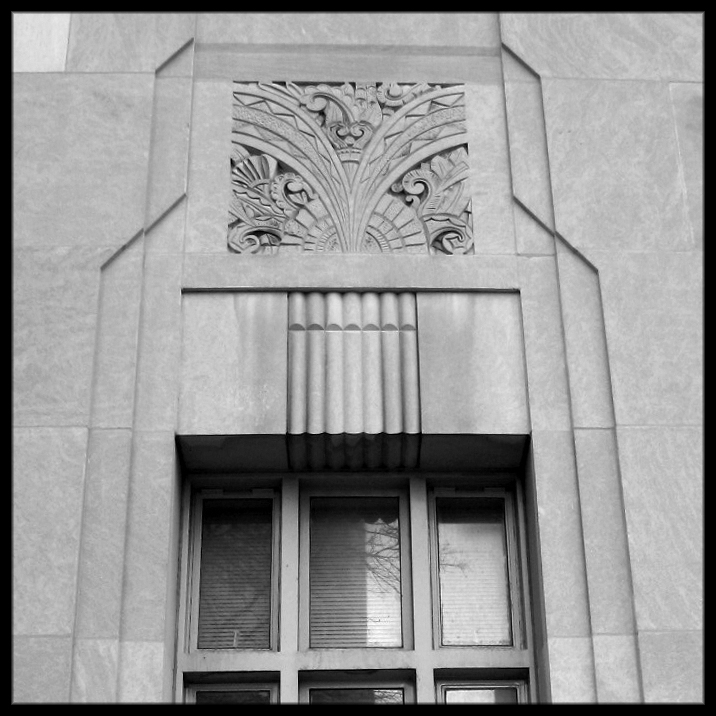
This screenshot has width=716, height=716. Find the location of `pane`. pane is located at coordinates (351, 619).